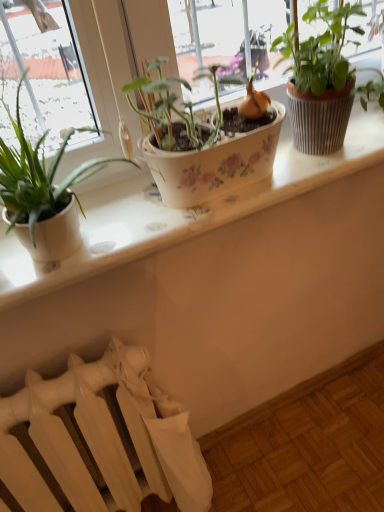
Question: Is textured brown pot at upper right, the 1th houseplant viewed from the right, far away from white ceramic window sill at center?

Choices:
 (A) no
 (B) yes

Answer: (A)

Question: Is textured brown pot at upper right, acting as the 2th houseplant starting from the left, further to the viewer compared to white ceramic window sill at center?

Choices:
 (A) yes
 (B) no

Answer: (B)

Question: Is white ceramic window sill at center at the back of textured brown pot at upper right, acting as the 2th houseplant starting from the left?

Choices:
 (A) yes
 (B) no

Answer: (B)

Question: Is textured brown pot at upper right, acting as the 2th houseplant starting from the left, at the left side of white ceramic window sill at center?

Choices:
 (A) yes
 (B) no

Answer: (B)

Question: Considering the relative sizes of textured brown pot at upper right, acting as the 2th houseplant starting from the left, and white ceramic window sill at center in the image provided, is textured brown pot at upper right, acting as the 2th houseplant starting from the left, thinner than white ceramic window sill at center?

Choices:
 (A) no
 (B) yes

Answer: (B)

Question: Is white ceramic window sill at center inside or outside of matte white pot at left, the 2th houseplant positioned from the right?

Choices:
 (A) inside
 (B) outside

Answer: (B)

Question: Is point (97, 266) closer or farther from the camera than point (59, 216)?

Choices:
 (A) closer
 (B) farther

Answer: (B)

Question: Is white ceramic window sill at center to the left or to the right of matte white pot at left, which ranks as the 1th houseplant in left-to-right order, in the image?

Choices:
 (A) left
 (B) right

Answer: (B)

Question: From a real-world perspective, relative to matte white pot at left, which ranks as the 1th houseplant in left-to-right order, is white ceramic window sill at center vertically above or below?

Choices:
 (A) below
 (B) above

Answer: (A)

Question: From a real-world perspective, is textured brown pot at upper right, the 1th houseplant viewed from the right, above or below white matte radiator at lower left?

Choices:
 (A) above
 (B) below

Answer: (A)

Question: Does point (326, 104) appear closer or farther from the camera than point (145, 448)?

Choices:
 (A) closer
 (B) farther

Answer: (A)

Question: Is textured brown pot at upper right, acting as the 2th houseplant starting from the left, bigger or smaller than white matte radiator at lower left?

Choices:
 (A) small
 (B) big

Answer: (A)

Question: From the image's perspective, relative to white matte radiator at lower left, is textured brown pot at upper right, the 1th houseplant viewed from the right, above or below?

Choices:
 (A) below
 (B) above

Answer: (B)

Question: Is white ceramic window sill at center in front of or behind textured brown pot at upper right, the 1th houseplant viewed from the right, in the image?

Choices:
 (A) front
 (B) behind

Answer: (B)

Question: From the image's perspective, is white ceramic window sill at center positioned above or below textured brown pot at upper right, the 1th houseplant viewed from the right?

Choices:
 (A) above
 (B) below

Answer: (B)